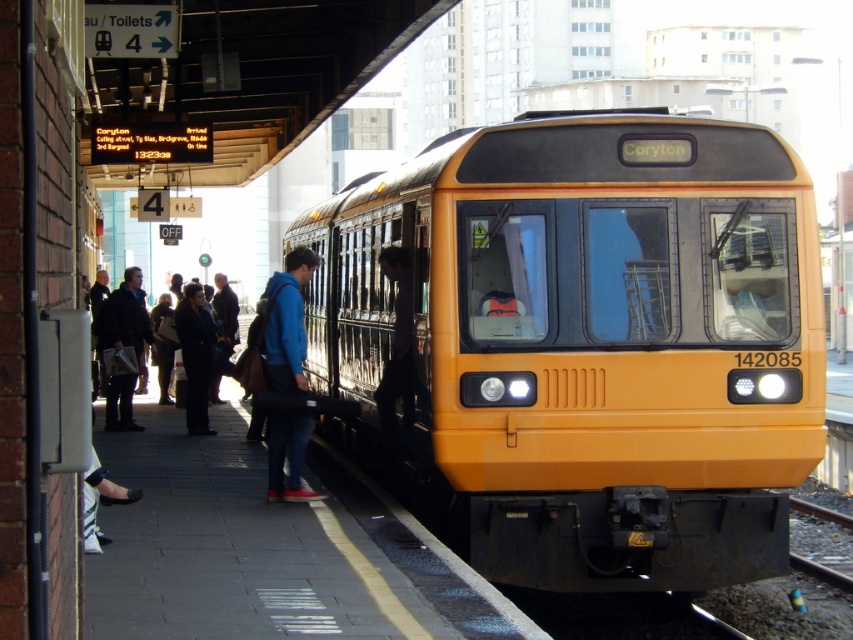
You are a passenger on the platform and want to board the yellow matte train at center. There is a blue fabric backpack at center blocking your path. Can you step around it to reach the train doors?

The yellow matte train at center is in front of the blue fabric backpack at center, meaning the backpack is behind the train. Since the train is in front, you can step around the backpack to reach the train doors as it is not blocking your path directly.

Consider the image. You are a passenger waiting on the platform and want to board the yellow matte train at center. There is a dark brown leather jacket at left blocking your path. Can you walk around the jacket to reach the train?

The yellow matte train at center is in front of the dark brown leather jacket at left, meaning the jacket is behind the train from your perspective. Therefore, you can walk around the jacket to reach the train.

You are a luggage cart operator who needs to move a large suitcase from the dark brown leather jacket at left to the yellow matte train at center. Considering the space between them, will the suitcase fit through without needing to be tilted or repositioned?

The yellow matte train at center is wider than the dark brown leather jacket at left. Since the train is wider, the space between them should accommodate the suitcase without needing to tilt or reposition it.